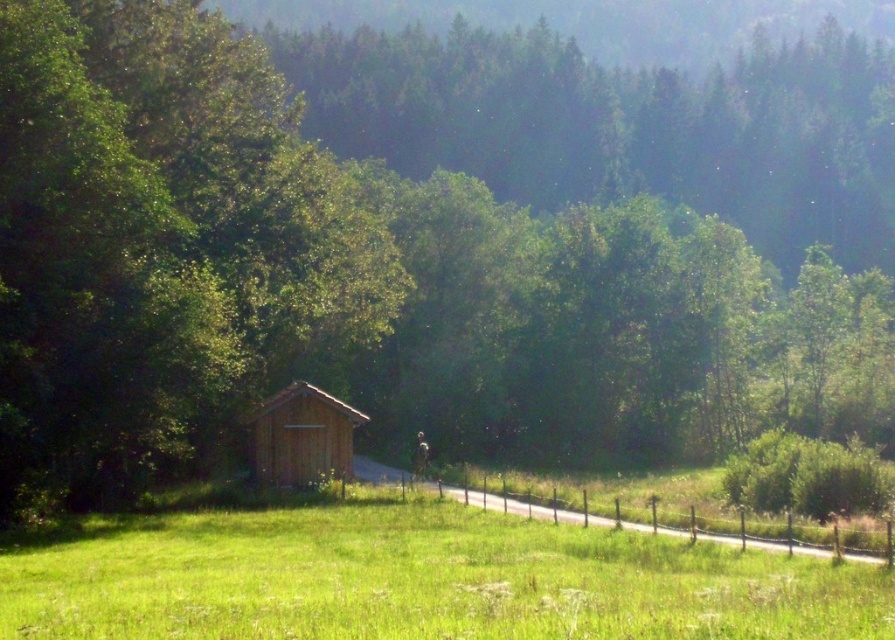
You are standing at the entrance of the wooden cabin at center and want to walk to the green grassy field at center. Which direction should you head?

The green grassy field at center is to the right of the wooden cabin at center, so you should head to the right to reach it.

You are planning to build a garden between the green grassy field at center and the wooden cabin at center. The garden requires a minimum of 50 feet of space. Can you determine if there is enough space between them to accommodate the garden?

The green grassy field at center is 57.09 feet from the wooden cabin at center, which exceeds the required 50 feet of space. Therefore, there is sufficient space to build the garden between them.